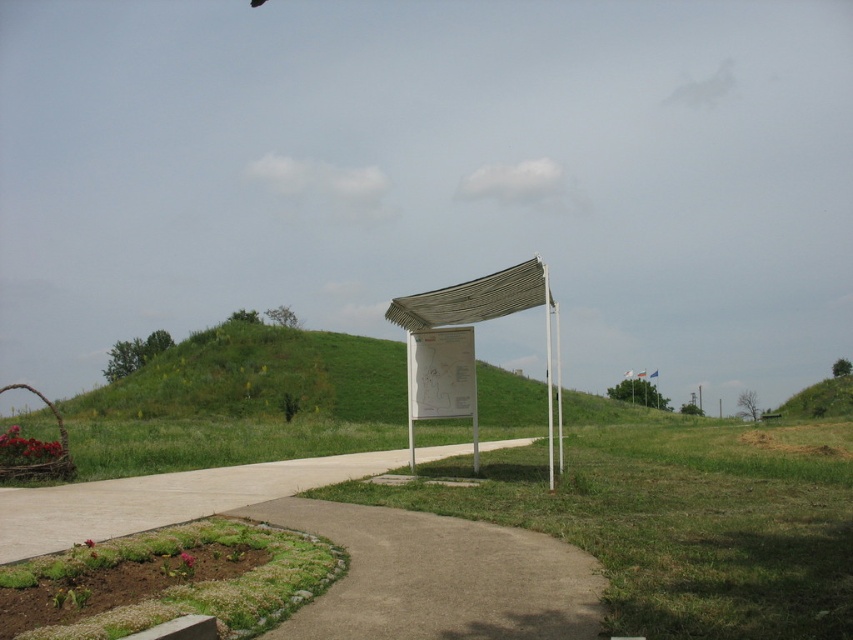
Question: Is white plastic sign at center positioned at the back of gray concrete pavement at lower center?

Choices:
 (A) no
 (B) yes

Answer: (A)

Question: Can you confirm if light gray concrete pavement at lower left is wider than white paper sign at center?

Choices:
 (A) no
 (B) yes

Answer: (B)

Question: Estimate the real-world distances between objects in this image. Which object is closer to the white plastic sign at center?

Choices:
 (A) white textured canopy at center
 (B) light gray concrete pavement at lower left
 (C) gray concrete pavement at lower center

Answer: (A)

Question: Considering the real-world distances, which object is farthest from the white plastic sign at center?

Choices:
 (A) light gray concrete pavement at lower left
 (B) gray concrete pavement at lower center
 (C) white textured canopy at center
 (D) white paper sign at center

Answer: (B)

Question: Is the position of white plastic sign at center less distant than that of white textured canopy at center?

Choices:
 (A) yes
 (B) no

Answer: (A)

Question: Which is farther from the light gray concrete pavement at lower left?

Choices:
 (A) white paper sign at center
 (B) white textured canopy at center

Answer: (B)